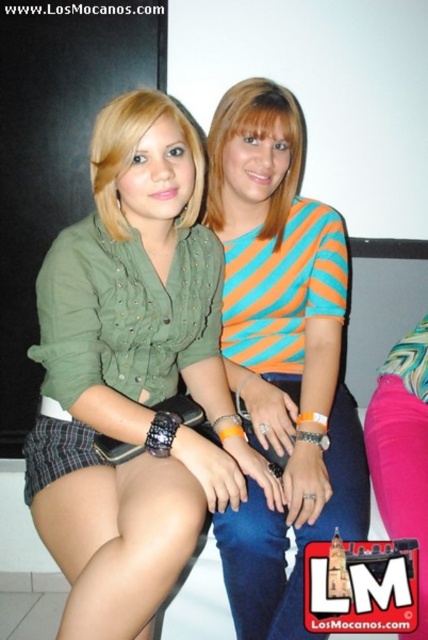
You are organizing a clothing donation drive and need to categorize shirts by size. You have two shirts in front of you, the green fabric shirt at center and the orange striped shirt at center. Which shirt should you place in the large size bin?

The green fabric shirt at center should be placed in the large size bin because it has a larger size compared to the orange striped shirt at center.

You are at a party and want to introduce yourself to the person wearing the orange striped shirt at center. Which direction should you move relative to the green fabric shirt at center to reach them?

The orange striped shirt at center is to the right of the green fabric shirt at center, so you should move to the right of the green fabric shirt at center to reach them.

You are a photographer adjusting your camera settings to focus on the green fabric shirt at center and the orange striped shirt at center. Which shirt should you focus on first to ensure proper depth of field?

The green fabric shirt at center is closer to the viewer than the orange striped shirt at center, so you should focus on the green fabric shirt at center first to ensure proper depth of field.